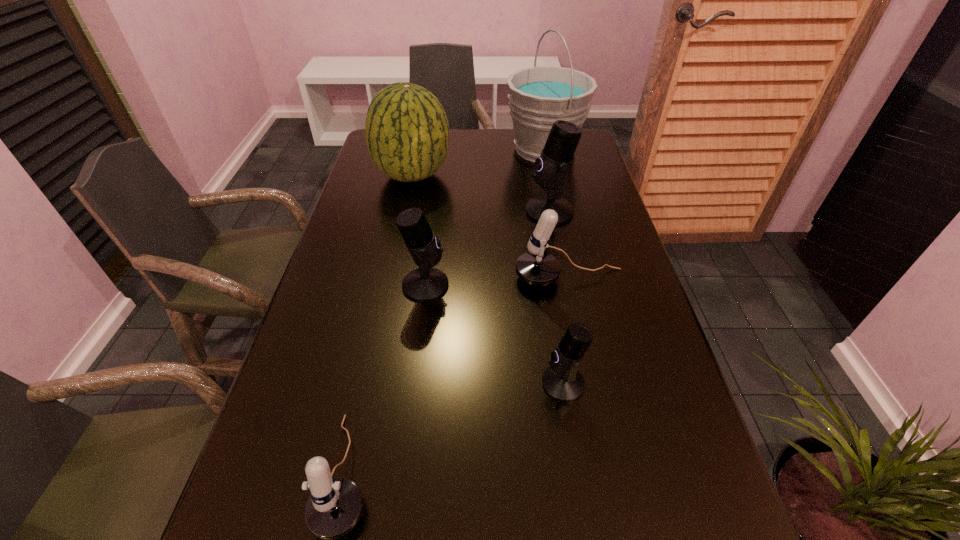
Locate an element on the screen. The image size is (960, 540). blue bucket is located at coordinates (538, 96).

The image size is (960, 540). Find the location of `the tallest object`. the tallest object is located at coordinates (538, 96).

This screenshot has height=540, width=960. I want to click on green watermelon, so click(x=407, y=133).

Find the location of a particular element. the tallest microphone is located at coordinates (551, 167).

Identify the location of the biggest black microphone. The image size is (960, 540). (551, 167).

Identify the location of the leftmost black microphone. (424, 284).

I want to click on the second smallest black microphone, so click(x=424, y=284).

Locate an element on the screen. the farther white microphone is located at coordinates tap(536, 267).

This screenshot has height=540, width=960. Find the location of `the right white microphone`. the right white microphone is located at coordinates (536, 267).

Image resolution: width=960 pixels, height=540 pixels. Find the location of `the nearest black microphone`. the nearest black microphone is located at coordinates (562, 381).